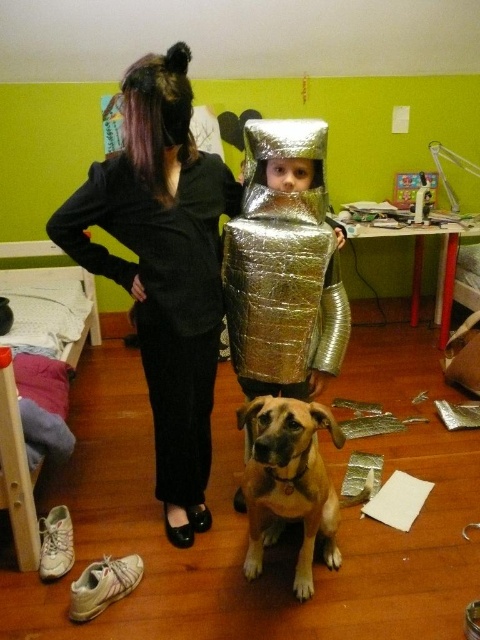
Between black fabric pants at center and golden-brown fur dog at center, which one is positioned higher?

black fabric pants at center

Which is more to the left, black fabric pants at center or golden-brown fur dog at center?

black fabric pants at center

Based on the photo, who is more distant from viewer, (135,230) or (279,509)?

Positioned behind is point (135,230).

The height and width of the screenshot is (640, 480). Find the location of `black fabric pants at center`. black fabric pants at center is located at coordinates (164, 268).